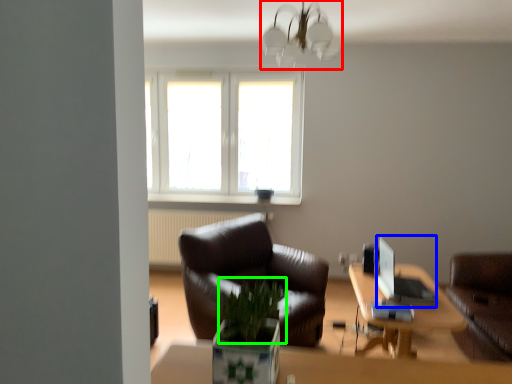
Question: Considering the real-world distances, which object is closest to lamp (highlighted by a red box)? computer (highlighted by a blue box) or plant (highlighted by a green box).

Choices:
 (A) computer
 (B) plant

Answer: (A)